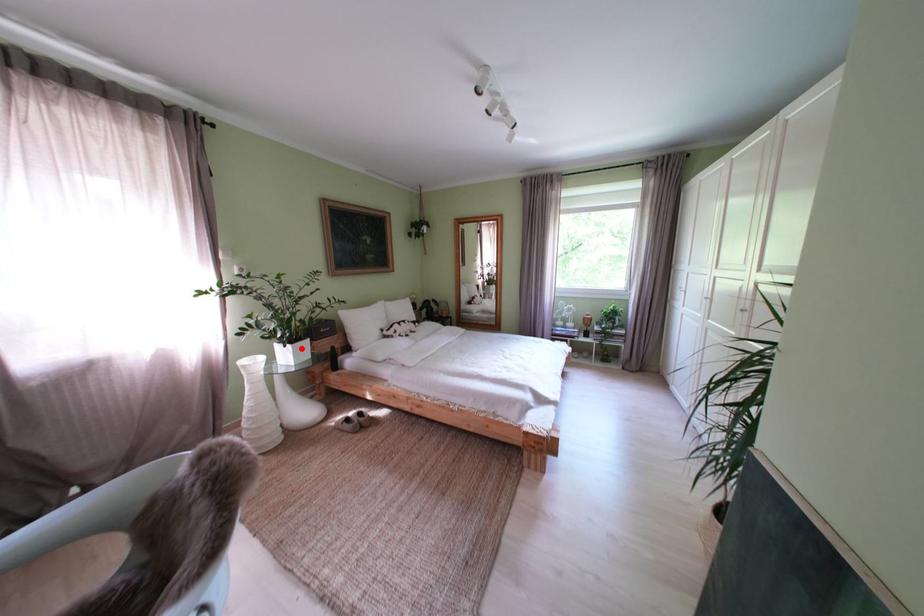
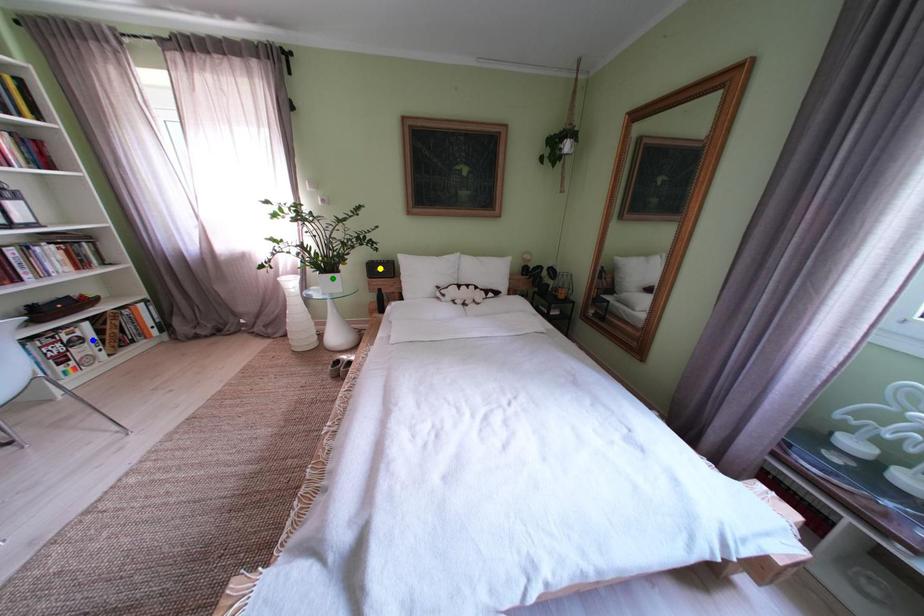
Question: I am providing you with two images of the same scene from different viewpoints. A red point is marked on the first image. You are given multiple points on the second image. Can you choose the point in image 2 that corresponds to the point in image 1?

Choices:
 (A) green point
 (B) yellow point
 (C) blue point

Answer: (A)